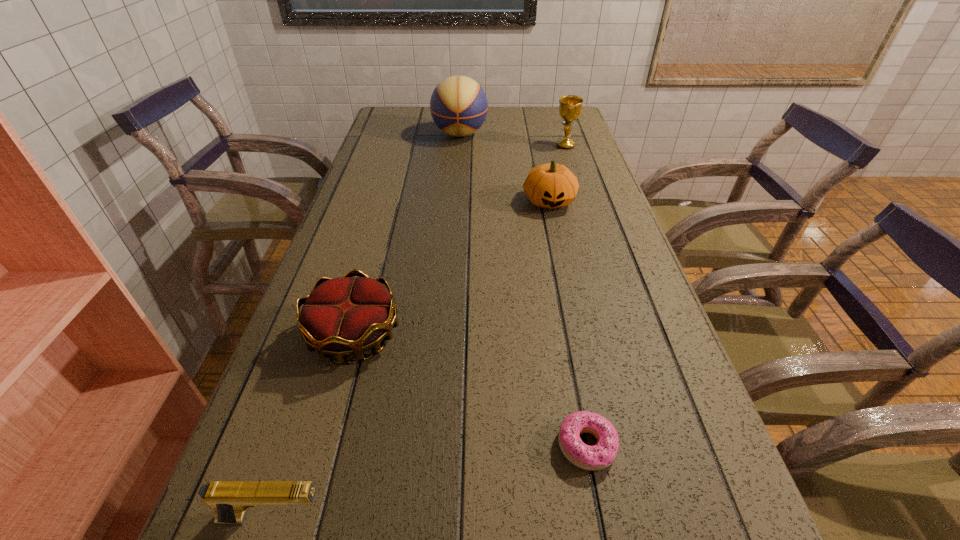
Where is `basketball`? This screenshot has height=540, width=960. basketball is located at coordinates (458, 105).

Image resolution: width=960 pixels, height=540 pixels. Find the location of `the second tallest object`. the second tallest object is located at coordinates click(x=570, y=106).

This screenshot has width=960, height=540. Find the location of `the third tallest object`. the third tallest object is located at coordinates (551, 185).

What are the coordinates of `the third farthest object` in the screenshot? It's located at (551, 185).

This screenshot has width=960, height=540. I want to click on the third nearest object, so click(345, 316).

Identify the location of the nearest object. click(x=230, y=499).

The image size is (960, 540). Identify the location of doughnut. (597, 457).

Find the location of a particular element. Image resolution: width=960 pixels, height=540 pixels. the second nearest object is located at coordinates (597, 457).

This screenshot has width=960, height=540. Find the location of `vacant space located on the patterned surface of the tallest object`. vacant space located on the patterned surface of the tallest object is located at coordinates (457, 176).

Identify the location of vacant point located 0.360m on the front of the fifth shortest object. (586, 210).